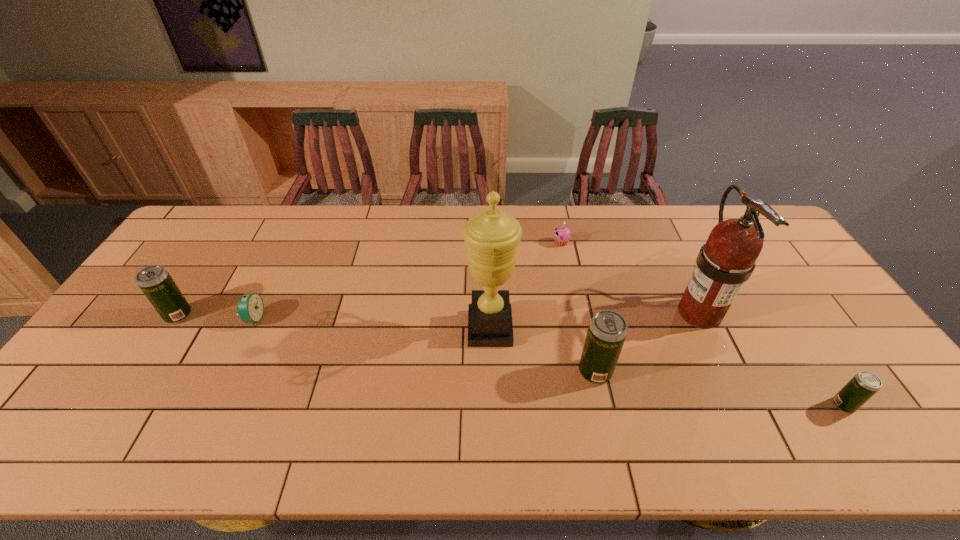
If we want them evenly spaced by inserting an extra beer_can among them, please locate a free spot for this new beer_can. Please provide its 2D coordinates. Your answer should be formatted as a tuple, i.e. [(x, y)], where the tuple contains the x and y coordinates of a point satisfying the conditions above.

[(375, 342)]